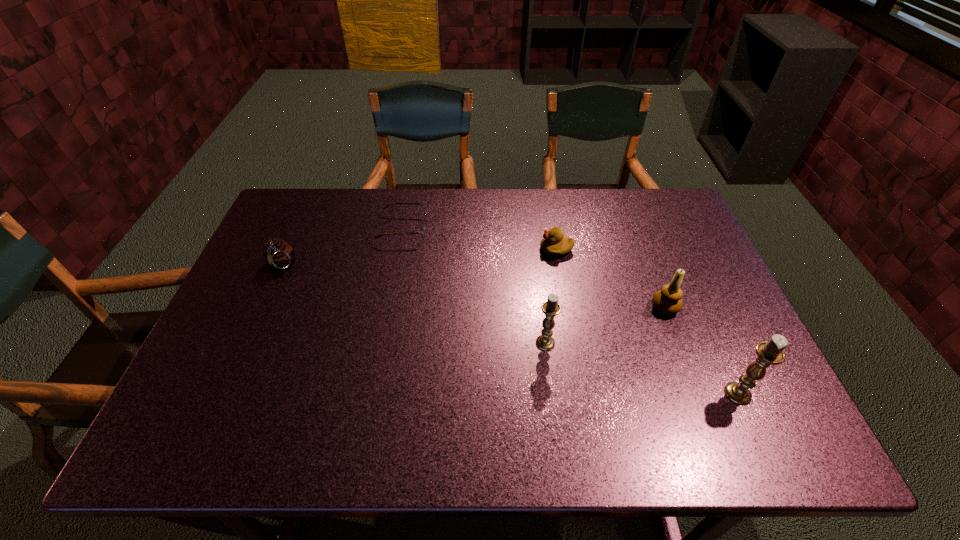
Please show where to add a candle holder on the left while keeping spacing even. Please provide its 2D coordinates. Your answer should be formatted as a tuple, i.e. [(x, y)], where the tuple contains the x and y coordinates of a point satisfying the conditions above.

[(384, 301)]